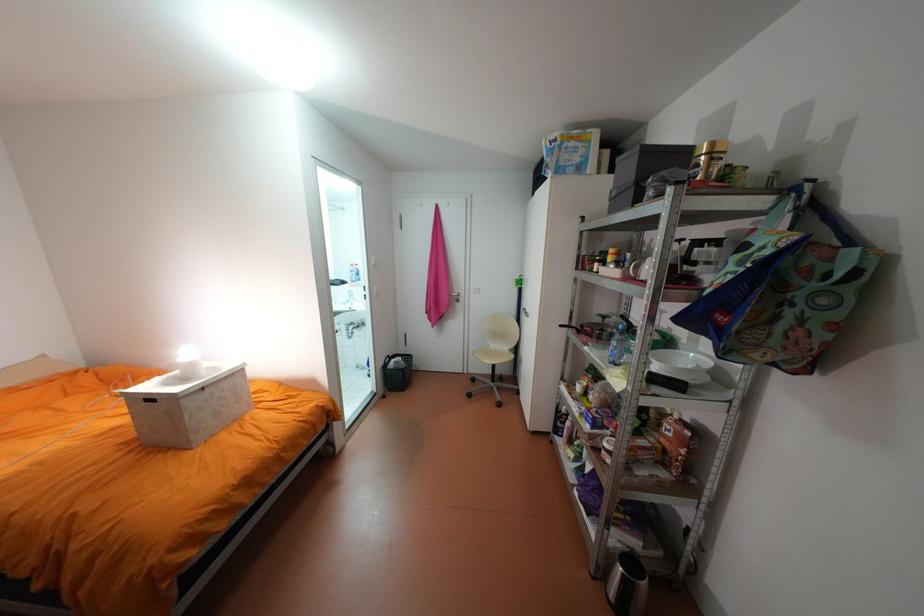
At what (x,y) coordinates should I click in order to perform the action: click on black cabinet handle. Please return your answer as a coordinate pair (x, y). Looking at the image, I should click on (519, 310).